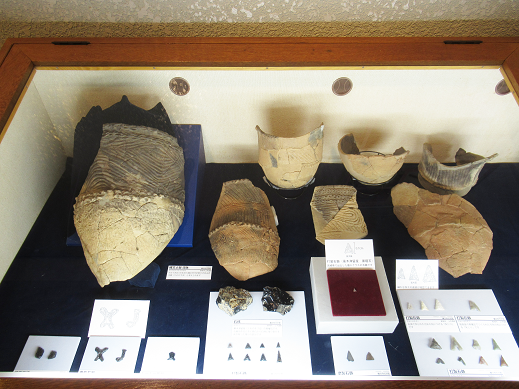
This screenshot has width=519, height=389. Identify the location of wooden glass window frame on top of display case. (119, 52).